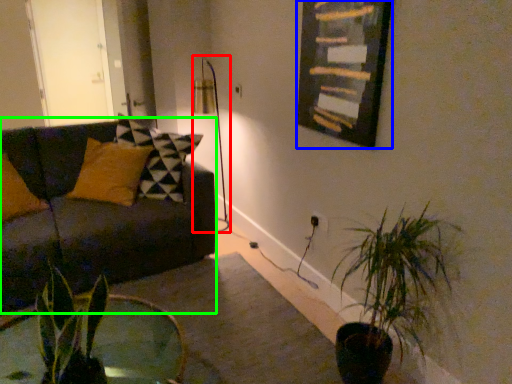
Question: Considering the real-world distances, which object is closest to table lamp (highlighted by a red box)? picture frame (highlighted by a blue box) or studio couch (highlighted by a green box).

Choices:
 (A) picture frame
 (B) studio couch

Answer: (B)